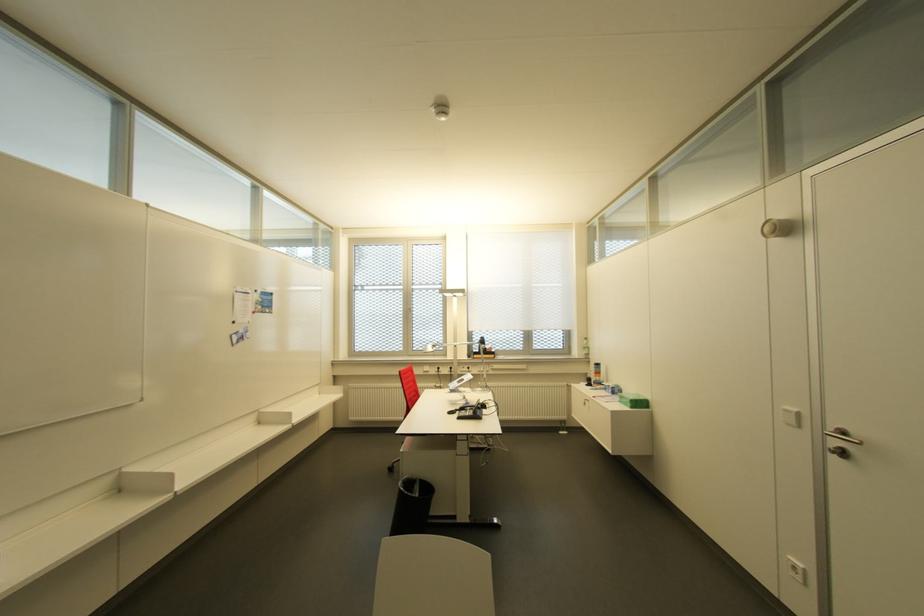
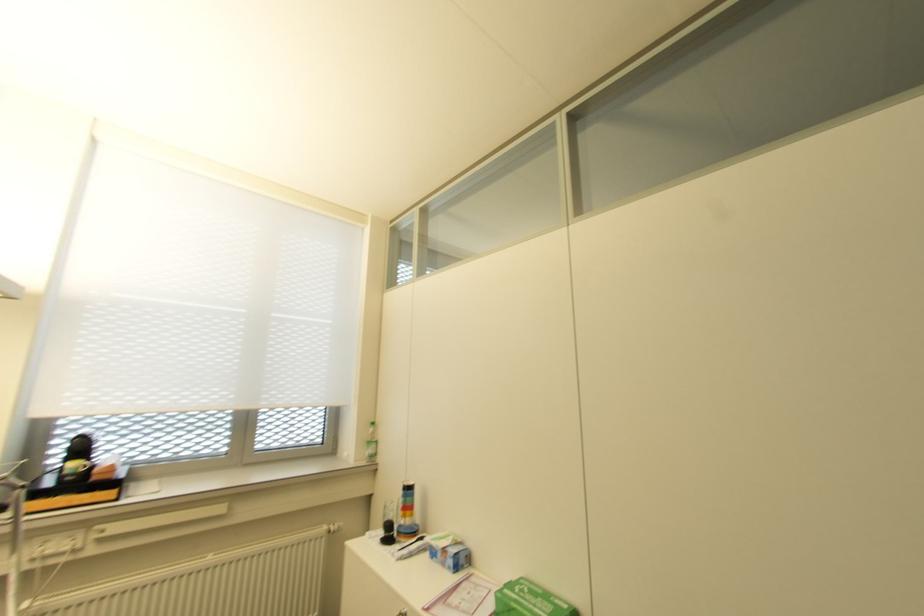
The point at (593, 377) is marked in the first image. Where is the corresponding point in the second image?

(402, 517)